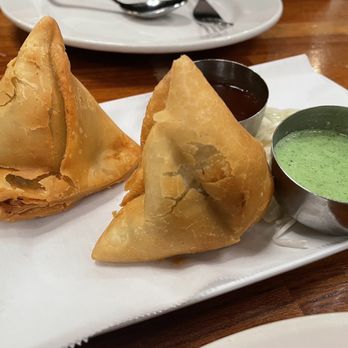
At what (x,y) coordinates should I click in order to perform the action: click on spoon. Please return your answer as a coordinate pair (x, y). Looking at the image, I should click on (160, 9).